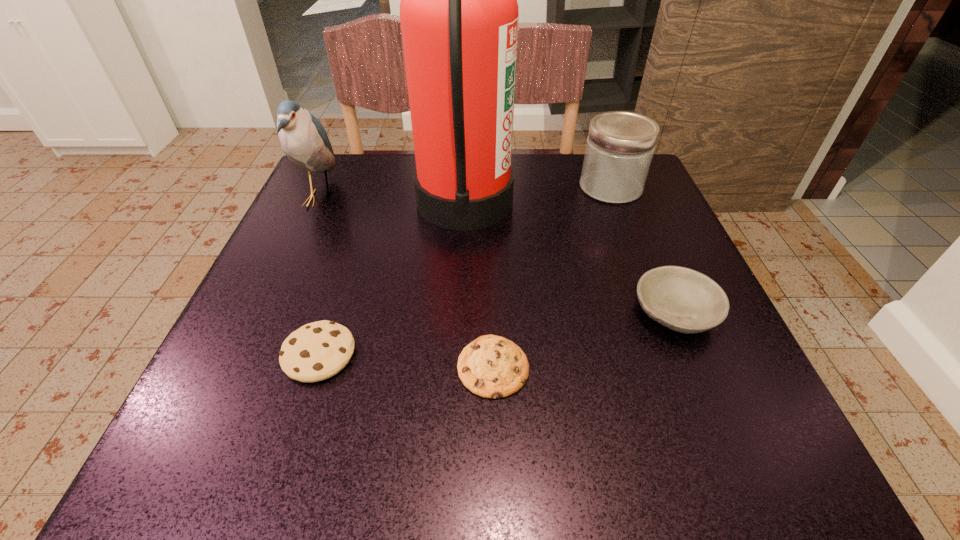
At what (x,y) coordinates should I click in order to perform the action: click on jar that is at the right edge. Please return your answer as a coordinate pair (x, y). Looking at the image, I should click on (620, 145).

Locate an element on the screen. The height and width of the screenshot is (540, 960). bowl present at the right edge is located at coordinates (684, 300).

Where is `object that is at the far left corner`? object that is at the far left corner is located at coordinates 304,140.

Identify the location of object present at the far right corner. Image resolution: width=960 pixels, height=540 pixels. (620, 145).

The width and height of the screenshot is (960, 540). I want to click on vacant region at the far edge of the desktop, so click(x=568, y=164).

Image resolution: width=960 pixels, height=540 pixels. I want to click on free space at the left edge of the desktop, so point(269,319).

The height and width of the screenshot is (540, 960). I want to click on free spot at the right edge of the desktop, so click(679, 333).

The image size is (960, 540). In the image, there is a desktop. Identify the location of vacant space at the far left corner. (321, 184).

At what (x,y) coordinates should I click in order to perform the action: click on free spot at the far right corner of the desktop. Please return your answer as a coordinate pair (x, y). The image size is (960, 540). Looking at the image, I should click on (646, 200).

At what (x,y) coordinates should I click in order to perform the action: click on free space at the near right corner of the desktop. Please return your answer as a coordinate pair (x, y). Looking at the image, I should click on (691, 472).